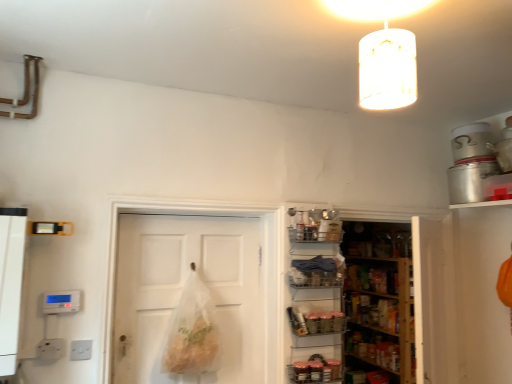
Question: Is white matte door at center taller than metallic wire basket at center, the second shelf in the bottom-to-top sequence?

Choices:
 (A) no
 (B) yes

Answer: (B)

Question: Does white matte door at center have a larger size compared to metallic wire basket at center, the second shelf in the bottom-to-top sequence?

Choices:
 (A) no
 (B) yes

Answer: (B)

Question: Is there a large distance between white matte door at center and metallic wire basket at center, arranged as the first shelf when viewed from the top?

Choices:
 (A) no
 (B) yes

Answer: (A)

Question: From a real-world perspective, is white matte door at center on metallic wire basket at center, the second shelf in the bottom-to-top sequence?

Choices:
 (A) yes
 (B) no

Answer: (B)

Question: Is white matte door at center positioned beyond the bounds of metallic wire basket at center, arranged as the first shelf when viewed from the top?

Choices:
 (A) no
 (B) yes

Answer: (B)

Question: Considering their positions, is metallic wire basket at center, positioned as the first shelf in bottom-to-top order, located in front of or behind white matte door at center?

Choices:
 (A) front
 (B) behind

Answer: (B)

Question: From their relative heights in the image, would you say metallic wire basket at center, which ranks as the 2th shelf in top-to-bottom order, is taller or shorter than white matte door at center?

Choices:
 (A) short
 (B) tall

Answer: (A)

Question: In terms of width, does metallic wire basket at center, which ranks as the 2th shelf in top-to-bottom order, look wider or thinner when compared to white matte door at center?

Choices:
 (A) thin
 (B) wide

Answer: (B)

Question: From a real-world perspective, relative to white matte door at center, is metallic wire basket at center, which ranks as the 2th shelf in top-to-bottom order, vertically above or below?

Choices:
 (A) above
 (B) below

Answer: (B)

Question: Which is correct: metallic wire basket at center, arranged as the first shelf when viewed from the top, is inside shiny metallic jars at center, or outside of it?

Choices:
 (A) inside
 (B) outside

Answer: (B)

Question: Is metallic wire basket at center, the second shelf in the bottom-to-top sequence, in front of or behind shiny metallic jars at center in the image?

Choices:
 (A) behind
 (B) front

Answer: (A)

Question: Is metallic wire basket at center, the second shelf in the bottom-to-top sequence, taller or shorter than shiny metallic jars at center?

Choices:
 (A) short
 (B) tall

Answer: (B)

Question: Is point (338, 273) positioned closer to the camera than point (311, 380)?

Choices:
 (A) farther
 (B) closer

Answer: (A)

Question: In terms of width, does shiny metallic jars at center look wider or thinner when compared to translucent white cylinder at upper center?

Choices:
 (A) wide
 (B) thin

Answer: (B)

Question: Is shiny metallic jars at center bigger or smaller than translucent white cylinder at upper center?

Choices:
 (A) big
 (B) small

Answer: (B)